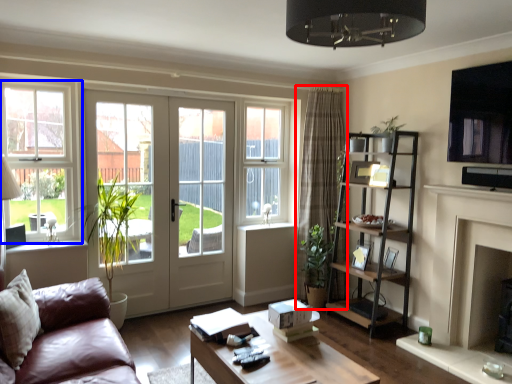
Question: Which of the following is the farthest to the observer, curtain (highlighted by a red box) or window (highlighted by a blue box)?

Choices:
 (A) curtain
 (B) window

Answer: (A)